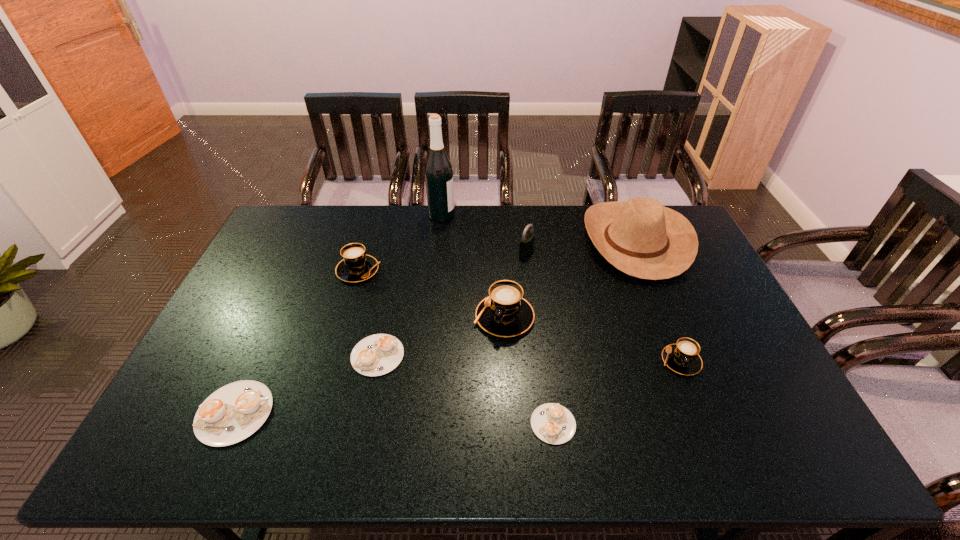
Where is `the sixth object from right to left`? The height and width of the screenshot is (540, 960). the sixth object from right to left is located at coordinates (438, 170).

Image resolution: width=960 pixels, height=540 pixels. Find the location of `wine bottle`. wine bottle is located at coordinates (438, 170).

Image resolution: width=960 pixels, height=540 pixels. In order to click on brown cowboy hat in this screenshot , I will do `click(640, 237)`.

At what (x,y) coordinates should I click in order to perform the action: click on the second tallest object. Please return your answer as a coordinate pair (x, y). The image size is (960, 540). Looking at the image, I should click on (640, 237).

You are a GUI agent. You are given a task and a screenshot of the screen. Output one action in this format:
    pyautogui.click(x=<x>, y=<y>)
    Task: Click on the black padlock
    
    Given the screenshot: What is the action you would take?
    pyautogui.click(x=527, y=242)

Locate an element on the screen. The height and width of the screenshot is (540, 960). the second black cappuccino from right to left is located at coordinates (504, 313).

Where is `the second farthest black cappuccino`? the second farthest black cappuccino is located at coordinates (504, 313).

Identify the location of the second tallest cappuccino. (356, 266).

This screenshot has height=540, width=960. I want to click on the farthest cappuccino, so click(x=356, y=266).

Where is `the fourth shortest object`? This screenshot has height=540, width=960. the fourth shortest object is located at coordinates (683, 358).